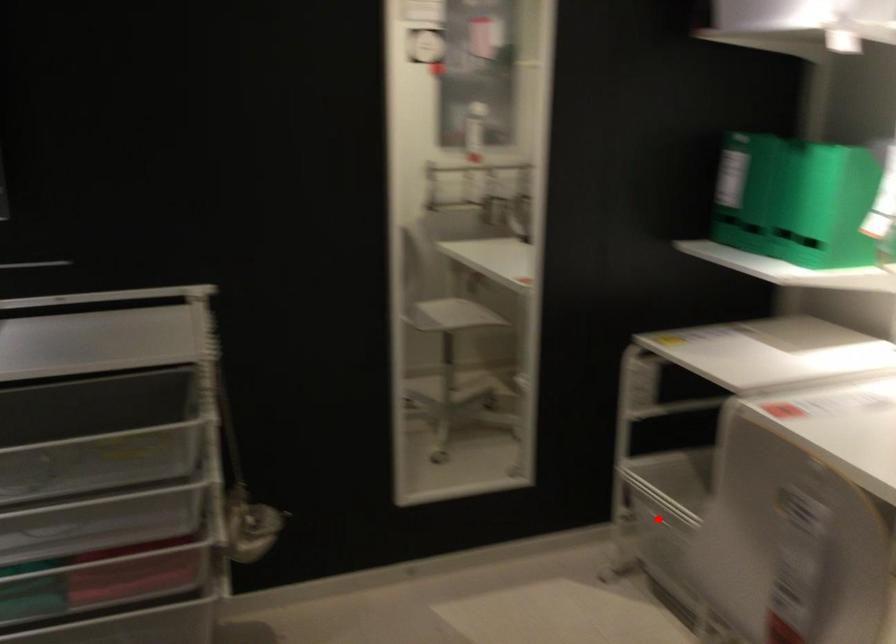
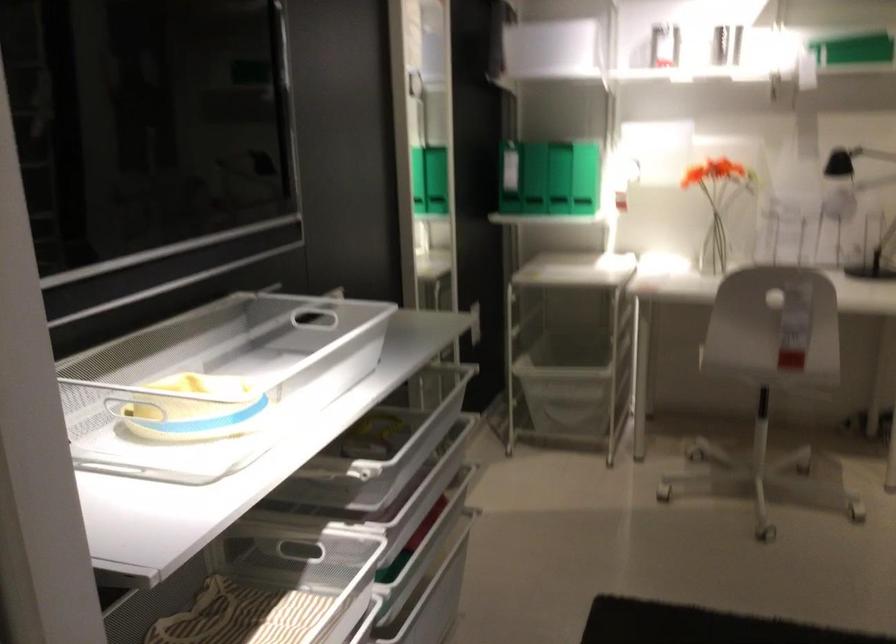
Find the pixel in the second image that matches the highlighted location in the first image.

(566, 381)